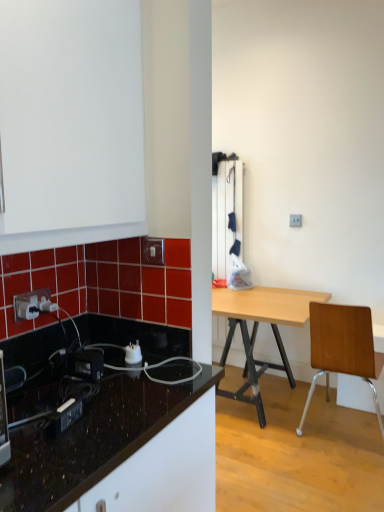
Question: Considering the relative positions of white plastic power plugs and sockets at lower left and white glossy electric outlet at upper center in the image provided, is white plastic power plugs and sockets at lower left in front of white glossy electric outlet at upper center?

Choices:
 (A) yes
 (B) no

Answer: (A)

Question: Is white glossy electric outlet at upper center a part of white plastic power plugs and sockets at lower left?

Choices:
 (A) yes
 (B) no

Answer: (B)

Question: Are white plastic power plugs and sockets at lower left and white glossy electric outlet at upper center located far from each other?

Choices:
 (A) no
 (B) yes

Answer: (A)

Question: Is white plastic power plugs and sockets at lower left facing towards white glossy electric outlet at upper center?

Choices:
 (A) no
 (B) yes

Answer: (A)

Question: From a real-world perspective, is white plastic power plugs and sockets at lower left located higher than white glossy electric outlet at upper center?

Choices:
 (A) yes
 (B) no

Answer: (B)

Question: Is white plastic power plugs and sockets at lower left thinner than white glossy electric outlet at upper center?

Choices:
 (A) no
 (B) yes

Answer: (A)

Question: From a real-world perspective, is white plastic power plugs and sockets at lower left positioned under brown wooden chair at right based on gravity?

Choices:
 (A) no
 (B) yes

Answer: (A)

Question: Would you say white plastic power plugs and sockets at lower left is a long distance from brown wooden chair at right?

Choices:
 (A) no
 (B) yes

Answer: (B)

Question: Is white plastic power plugs and sockets at lower left to the left of brown wooden chair at right from the viewer's perspective?

Choices:
 (A) no
 (B) yes

Answer: (B)

Question: Is white plastic power plugs and sockets at lower left aimed at brown wooden chair at right?

Choices:
 (A) yes
 (B) no

Answer: (B)

Question: Can you confirm if white plastic power plugs and sockets at lower left is taller than brown wooden chair at right?

Choices:
 (A) no
 (B) yes

Answer: (A)

Question: Does white plastic power plugs and sockets at lower left have a lesser height compared to brown wooden chair at right?

Choices:
 (A) no
 (B) yes

Answer: (B)

Question: Considering the relative sizes of brown wooden chair at right and black glossy countertop at lower left in the image provided, is brown wooden chair at right taller than black glossy countertop at lower left?

Choices:
 (A) no
 (B) yes

Answer: (B)